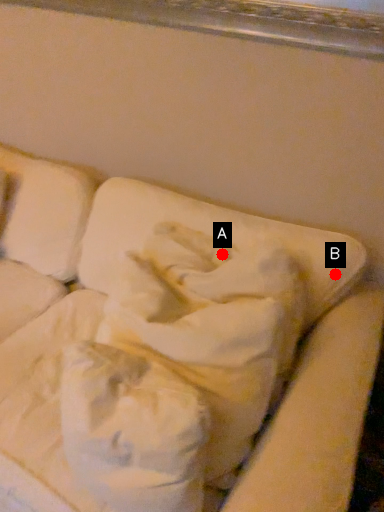
Question: Two points are circled on the image, labeled by A and B beside each circle. Which point is farther to the camera?

Choices:
 (A) A is further
 (B) B is further

Answer: (A)